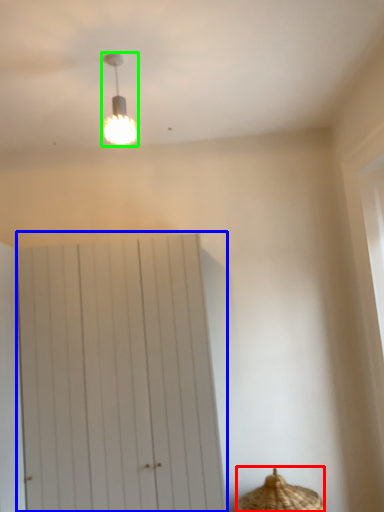
Question: Which is farther away from basket (highlighted by a red box)? barn door (highlighted by a blue box) or lamp (highlighted by a green box)?

Choices:
 (A) barn door
 (B) lamp

Answer: (B)